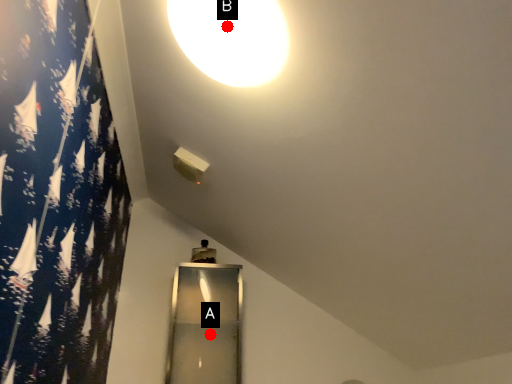
Question: Two points are circled on the image, labeled by A and B beside each circle. Which point is closer to the camera taking this photo?

Choices:
 (A) A is closer
 (B) B is closer

Answer: (B)